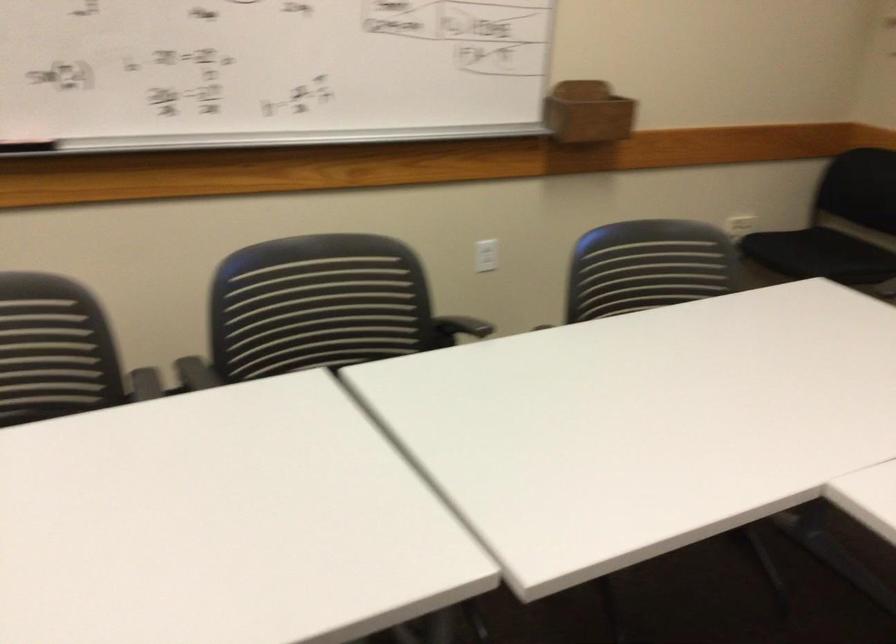
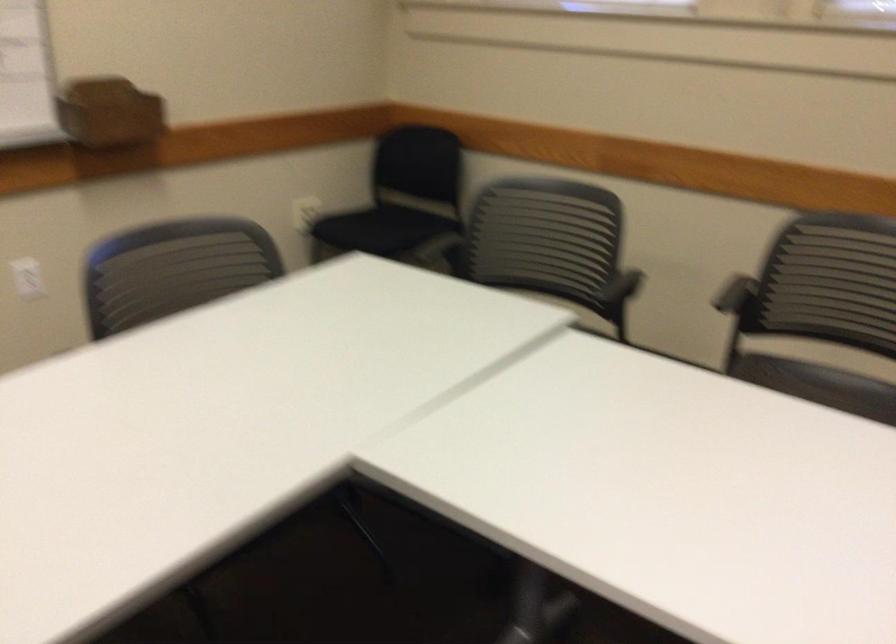
Question: The images are taken continuously from a first-person perspective. In which direction is your viewpoint rotating?

Choices:
 (A) Left
 (B) Right
 (C) Up
 (D) Down

Answer: (B)